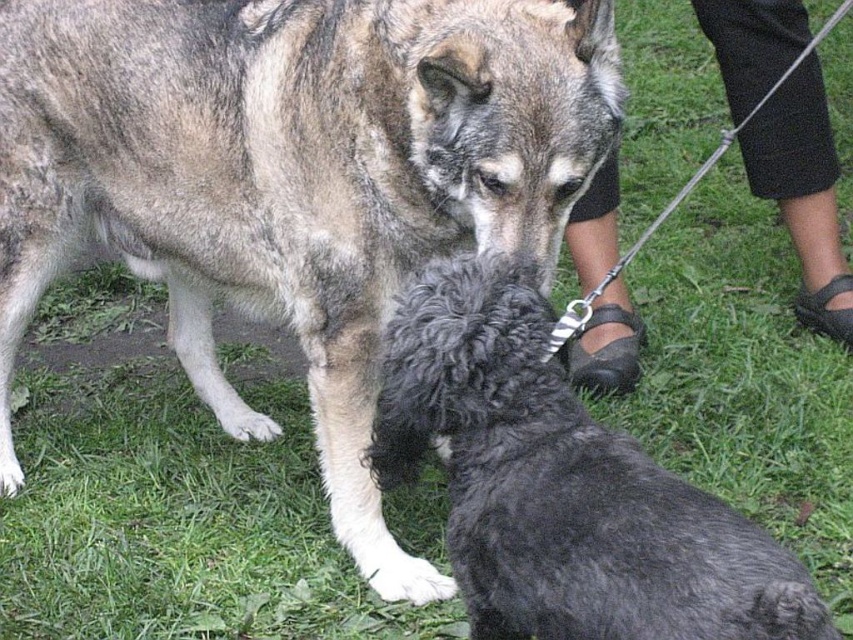
Question: Which object appears farthest from the camera in this image?

Choices:
 (A) black leather sandals at lower right
 (B) shiny black fur at center
 (C) shaggy black dog at center

Answer: (A)

Question: Is shaggy black dog at center behind black leather sandals at lower right?

Choices:
 (A) yes
 (B) no

Answer: (B)

Question: Is shaggy black dog at center to the right of black leather sandals at lower right from the viewer's perspective?

Choices:
 (A) no
 (B) yes

Answer: (A)

Question: Based on their relative distances, which object is nearer to the black leather sandals at lower right?

Choices:
 (A) shaggy black dog at center
 (B) shiny black fur at center

Answer: (A)

Question: Considering the real-world distances, which object is farthest from the shaggy black dog at center?

Choices:
 (A) black leather sandals at lower right
 (B) shiny black fur at center

Answer: (A)

Question: Is shiny black fur at center below black leather sandals at lower right?

Choices:
 (A) no
 (B) yes

Answer: (B)